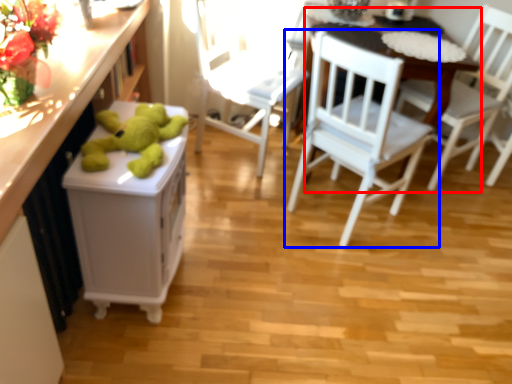
Question: Which object appears farthest to the camera in this image, table (highlighted by a red box) or chair (highlighted by a blue box)?

Choices:
 (A) table
 (B) chair

Answer: (A)